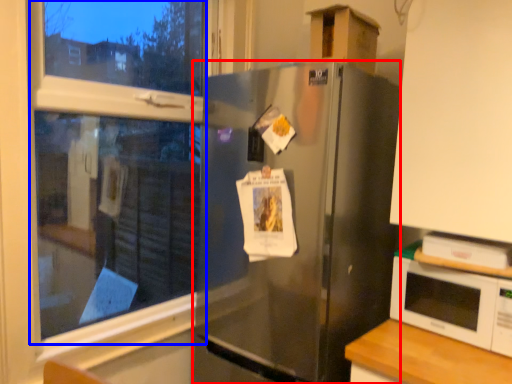
Question: Which point is closer to the camera, refrigerator (highlighted by a red box) or bay window (highlighted by a blue box)?

Choices:
 (A) refrigerator
 (B) bay window

Answer: (B)